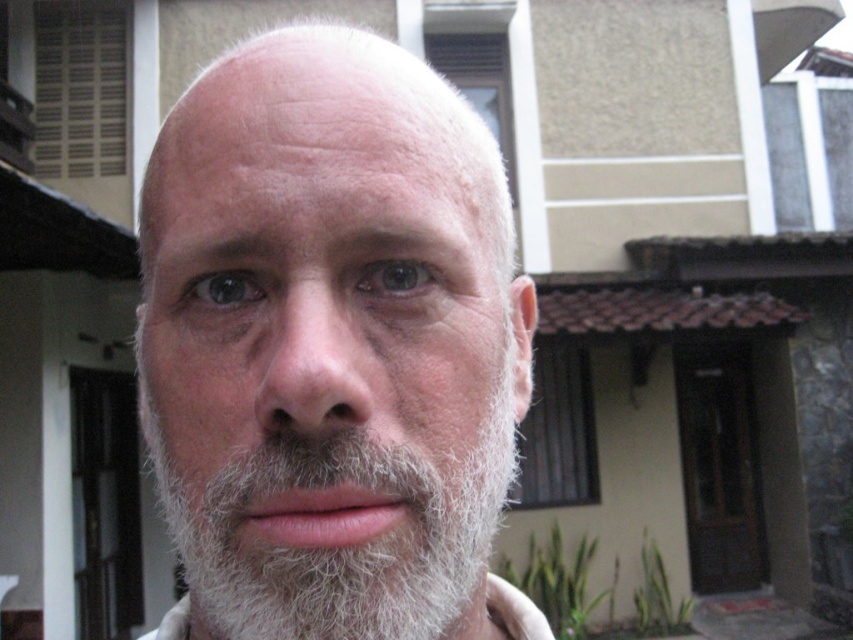
Is gray fuzzy beard at center to the left of white matte hair at center from the viewer's perspective?

Correct, you'll find gray fuzzy beard at center to the left of white matte hair at center.

Who is higher up, gray fuzzy beard at center or white matte hair at center?

white matte hair at center

The width and height of the screenshot is (853, 640). Describe the element at coordinates (337, 536) in the screenshot. I see `gray fuzzy beard at center` at that location.

Where is `gray fuzzy beard at center`? gray fuzzy beard at center is located at coordinates (337, 536).